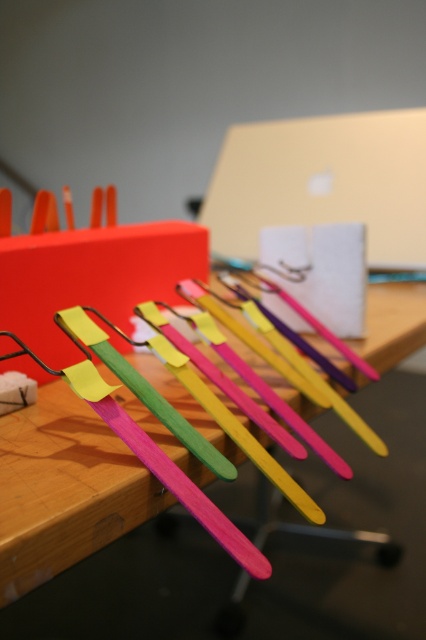
Question: Which object appears farthest from the camera in this image?

Choices:
 (A) metallic gold laptop at center
 (B) wooden table at center

Answer: (A)

Question: Is wooden table at center wider than metallic gold laptop at center?

Choices:
 (A) no
 (B) yes

Answer: (B)

Question: Is wooden table at center to the left of metallic gold laptop at center from the viewer's perspective?

Choices:
 (A) yes
 (B) no

Answer: (A)

Question: In this image, where is wooden table at center located relative to metallic gold laptop at center?

Choices:
 (A) right
 (B) left

Answer: (B)

Question: Which object appears closest to the camera in this image?

Choices:
 (A) wooden table at center
 (B) metallic gold laptop at center

Answer: (A)